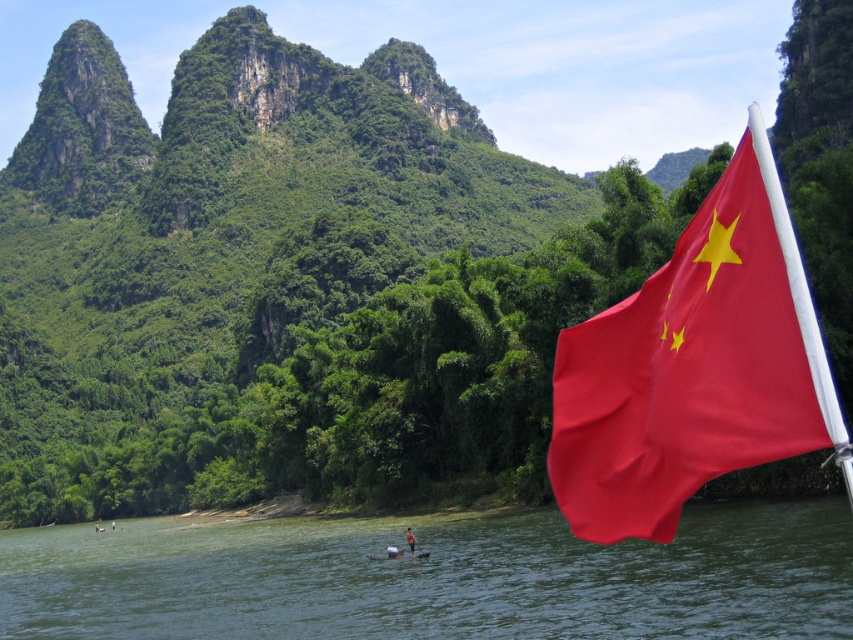
You are navigating a small boat on the river in the image. You see a point marked at coordinates (434, 577). What is located at that point?

The point at coordinates (434, 577) is green water at river right.

You are standing on the smooth wooden boat at center and want to reach the smooth skin person at lower center. Which direction should you move to get closer to them?

Since the smooth wooden boat at center is closer to the viewer than the smooth skin person at lower center, you should move forward towards the person to get closer.